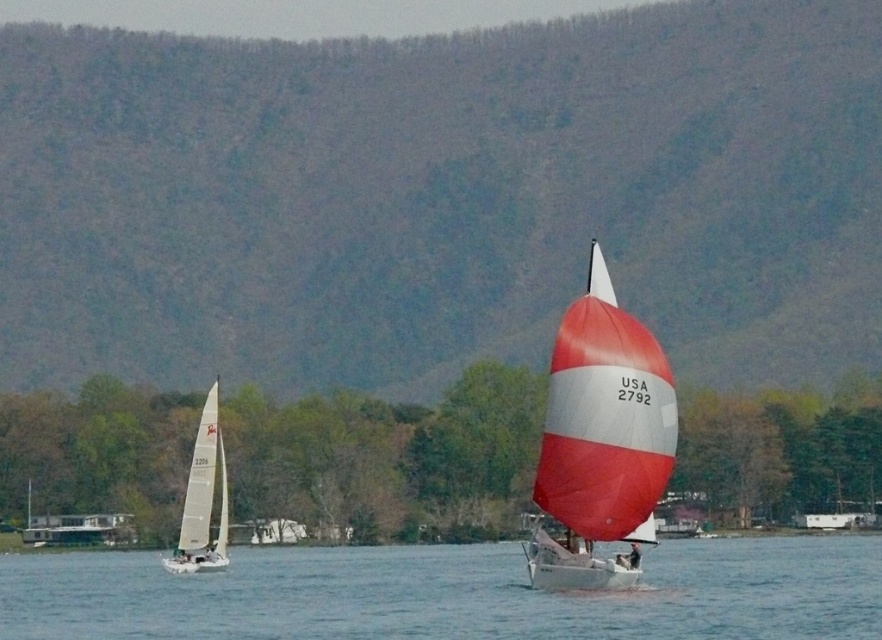
From the picture: Who is lower down, clear blue water at center or red and white striped sailboat at center?

clear blue water at center

Describe the element at coordinates (450, 595) in the screenshot. I see `clear blue water at center` at that location.

Which is in front, point (722, 628) or point (603, 298)?

Point (722, 628)

Locate an element on the screen. The height and width of the screenshot is (640, 882). clear blue water at center is located at coordinates (450, 595).

Between point (13, 596) and point (210, 429), which one is positioned behind?

Positioned behind is point (13, 596).

Between point (471, 586) and point (210, 508), which one is positioned in front?

Point (471, 586)

Which is in front, point (350, 616) or point (200, 557)?

Point (350, 616) is more forward.

This screenshot has height=640, width=882. I want to click on clear blue water at center, so click(450, 595).

Does red and white striped sailboat at center appear under white matte sailboat at left?

No, red and white striped sailboat at center is not below white matte sailboat at left.

Where is `red and white striped sailboat at center`? red and white striped sailboat at center is located at coordinates (602, 442).